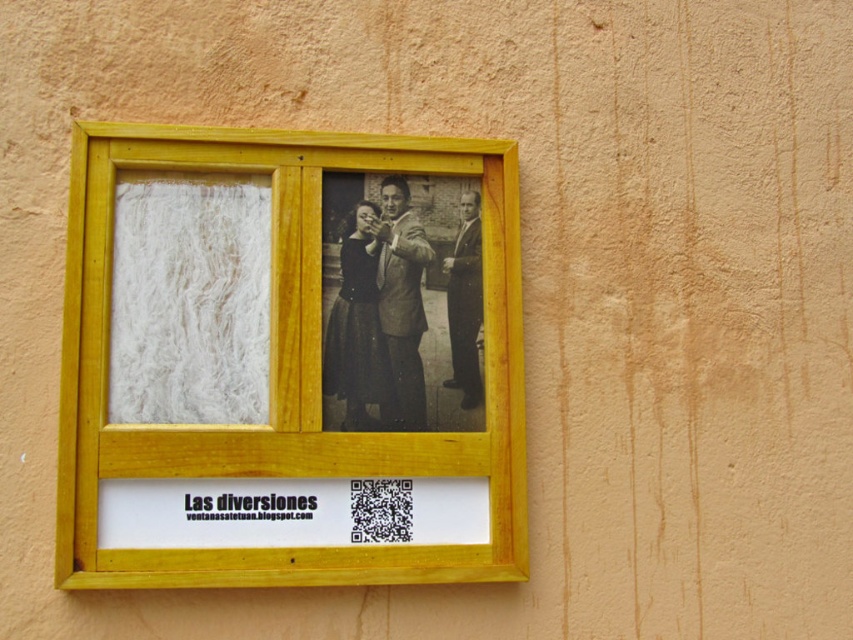
Can you confirm if yellow wood photo frame at upper left is positioned to the right of black glossy suit at center?

Incorrect, yellow wood photo frame at upper left is not on the right side of black glossy suit at center.

Who is higher up, yellow wood photo frame at upper left or black glossy suit at center?

black glossy suit at center is higher up.

Where is `yellow wood photo frame at upper left`? The height and width of the screenshot is (640, 853). yellow wood photo frame at upper left is located at coordinates (286, 371).